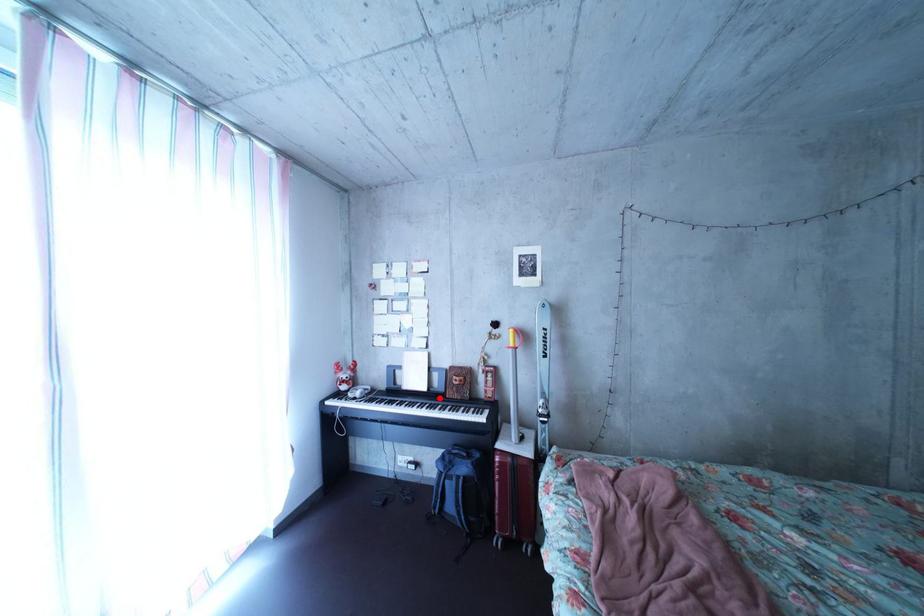
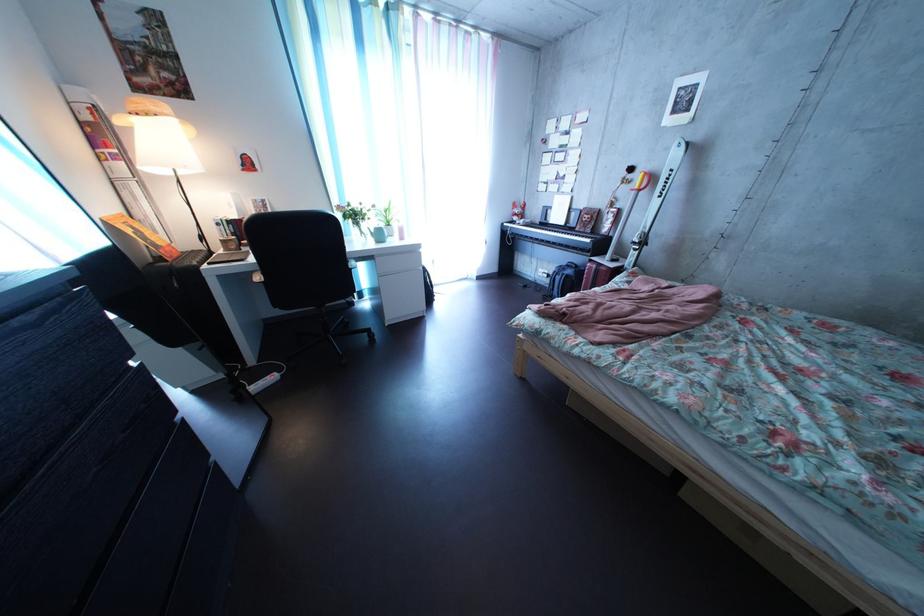
The point at the highlighted location is marked in the first image. Where is the corresponding point in the second image?

(577, 232)